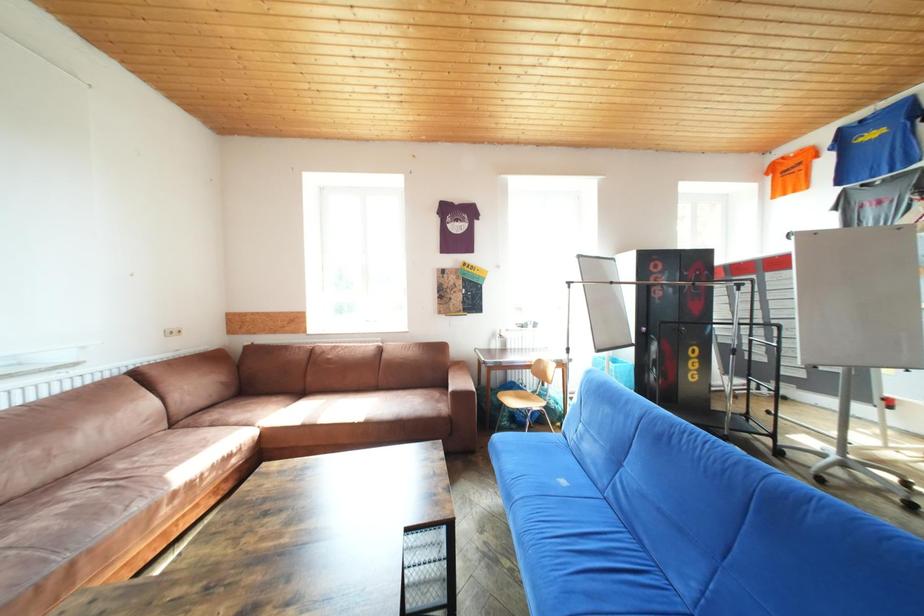
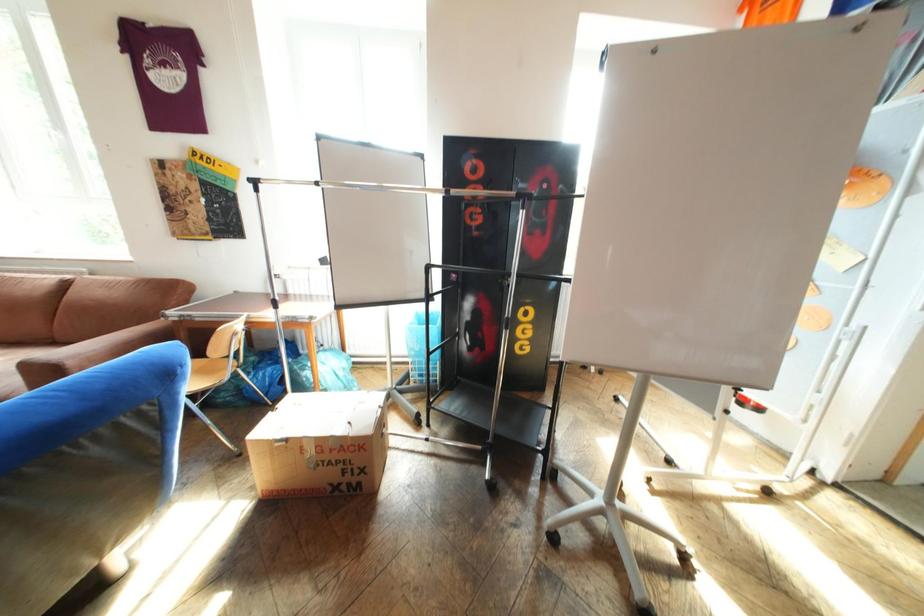
Which direction would the cameraman need to move to produce the second image?

The cameraman walked toward right, forward.